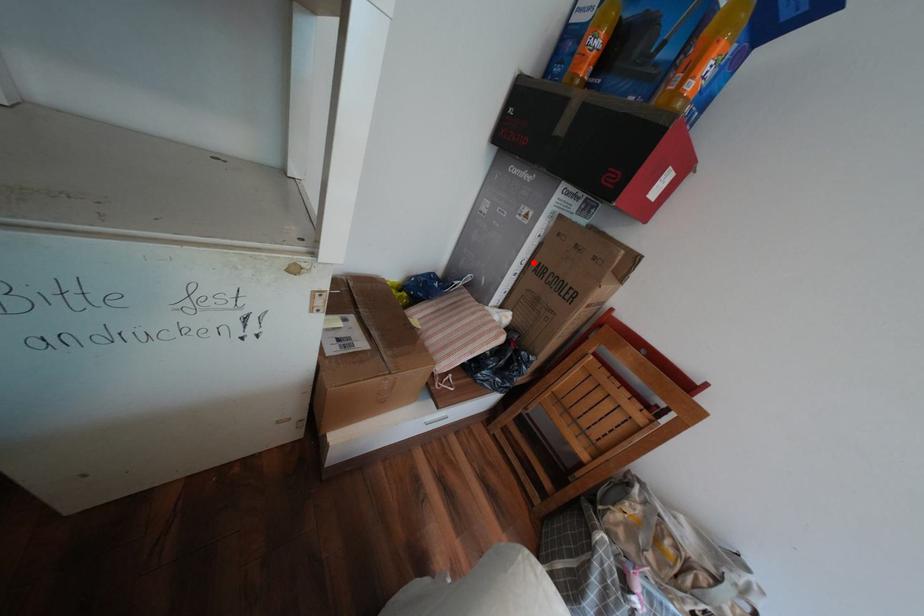
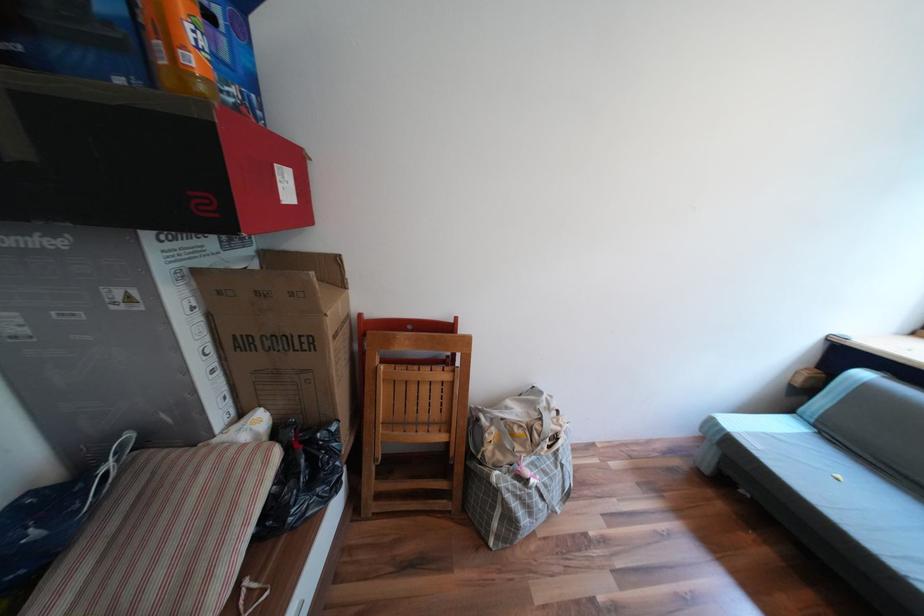
Question: I am providing you with two images of the same scene from different viewpoints. A red point is marked on the first image. Is the red point's position out of view in image 2?

Choices:
 (A) Yes
 (B) No

Answer: (B)